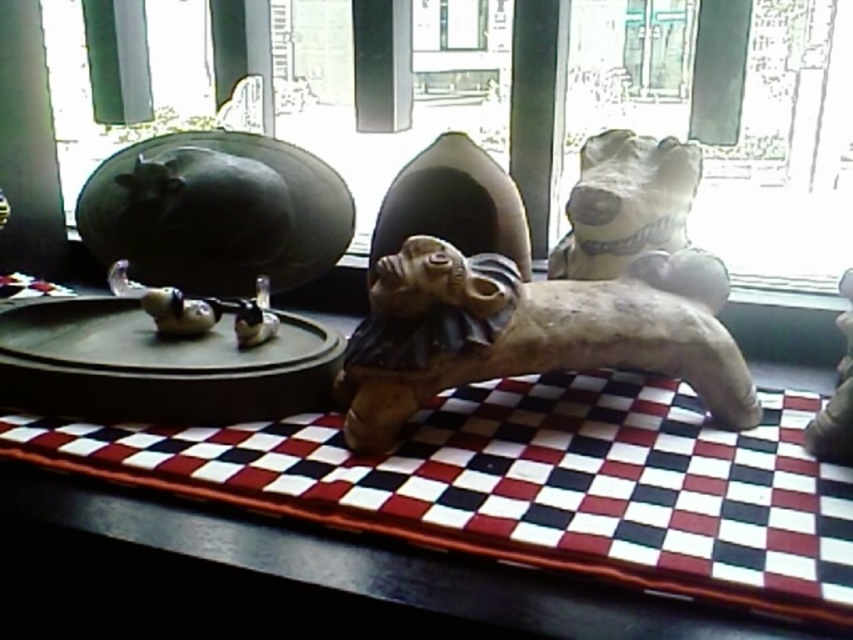
You are looking at the image and want to know which of the two points, point (596, 627) or point (699, 317), is closer to you. Based on the scene description, can you determine which one is nearer?

Point (596, 627) is closer to the camera than point (699, 317), so it is nearer to you.